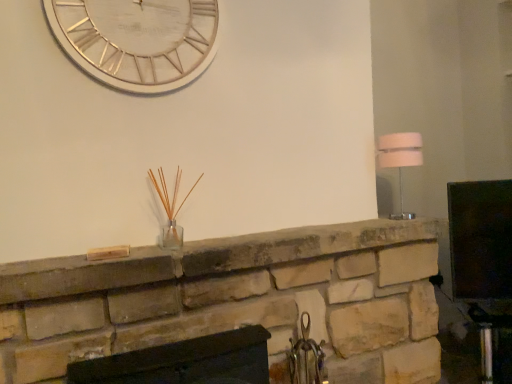
Question: Is matte black fireplace at center, the second fireplace positioned from the top, positioned behind natural stone fireplace at center, arranged as the 1th fireplace when viewed from the top?

Choices:
 (A) no
 (B) yes

Answer: (A)

Question: Considering the relative sizes of matte black fireplace at center, the second fireplace positioned from the top, and natural stone fireplace at center, arranged as the 1th fireplace when viewed from the top, in the image provided, is matte black fireplace at center, the second fireplace positioned from the top, wider than natural stone fireplace at center, arranged as the 1th fireplace when viewed from the top,?

Choices:
 (A) yes
 (B) no

Answer: (B)

Question: Considering the relative positions of matte black fireplace at center, the second fireplace positioned from the top, and natural stone fireplace at center, which is the 2th fireplace in bottom-to-top order, in the image provided, is matte black fireplace at center, the second fireplace positioned from the top, to the left of natural stone fireplace at center, which is the 2th fireplace in bottom-to-top order, from the viewer's perspective?

Choices:
 (A) yes
 (B) no

Answer: (A)

Question: Is matte black fireplace at center, positioned as the 1th fireplace in bottom-to-top order, surrounding natural stone fireplace at center, arranged as the 1th fireplace when viewed from the top?

Choices:
 (A) yes
 (B) no

Answer: (B)

Question: Does matte black fireplace at center, the second fireplace positioned from the top, have a smaller size compared to natural stone fireplace at center, which is the 2th fireplace in bottom-to-top order?

Choices:
 (A) no
 (B) yes

Answer: (B)

Question: From a real-world perspective, relative to matte black fireplace at center, the second fireplace positioned from the top, is white metallic clock at upper center vertically above or below?

Choices:
 (A) below
 (B) above

Answer: (B)

Question: Based on their positions, is white metallic clock at upper center located to the left or right of matte black fireplace at center, positioned as the 1th fireplace in bottom-to-top order?

Choices:
 (A) right
 (B) left

Answer: (B)

Question: Is white metallic clock at upper center taller or shorter than matte black fireplace at center, the second fireplace positioned from the top?

Choices:
 (A) short
 (B) tall

Answer: (B)

Question: Is white metallic clock at upper center inside or outside of matte black fireplace at center, the second fireplace positioned from the top?

Choices:
 (A) inside
 (B) outside

Answer: (B)

Question: From the image's perspective, is natural stone fireplace at center, which is the 2th fireplace in bottom-to-top order, located above or below white metallic clock at upper center?

Choices:
 (A) above
 (B) below

Answer: (B)

Question: In the image, is natural stone fireplace at center, which is the 2th fireplace in bottom-to-top order, positioned in front of or behind white metallic clock at upper center?

Choices:
 (A) front
 (B) behind

Answer: (A)

Question: Is natural stone fireplace at center, which is the 2th fireplace in bottom-to-top order, bigger or smaller than white metallic clock at upper center?

Choices:
 (A) big
 (B) small

Answer: (A)

Question: Is natural stone fireplace at center, arranged as the 1th fireplace when viewed from the top, taller or shorter than white metallic clock at upper center?

Choices:
 (A) short
 (B) tall

Answer: (A)

Question: From the image's perspective, relative to white fabric lampshade at right, is white metallic clock at upper center above or below?

Choices:
 (A) below
 (B) above

Answer: (B)

Question: Is white metallic clock at upper center situated inside white fabric lampshade at right or outside?

Choices:
 (A) outside
 (B) inside

Answer: (A)